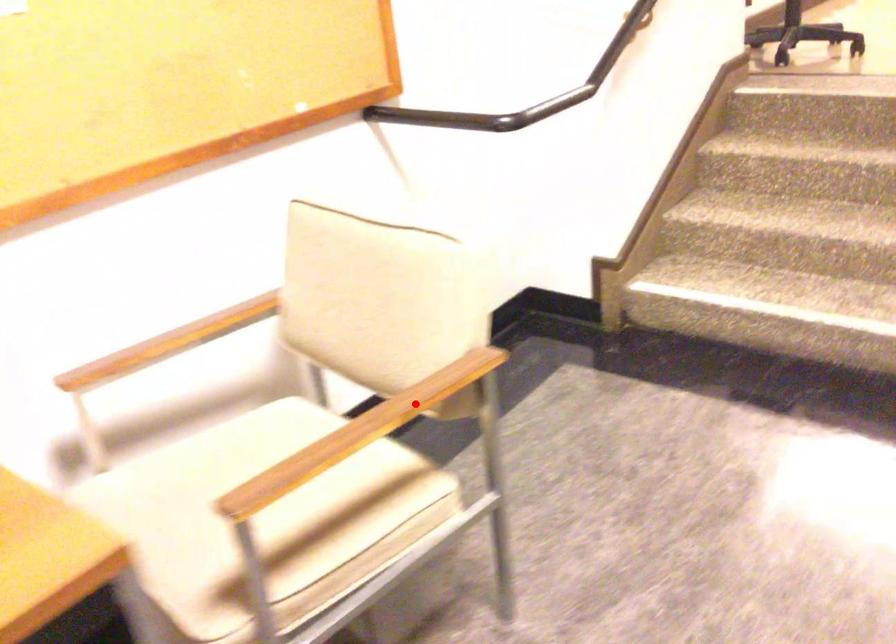
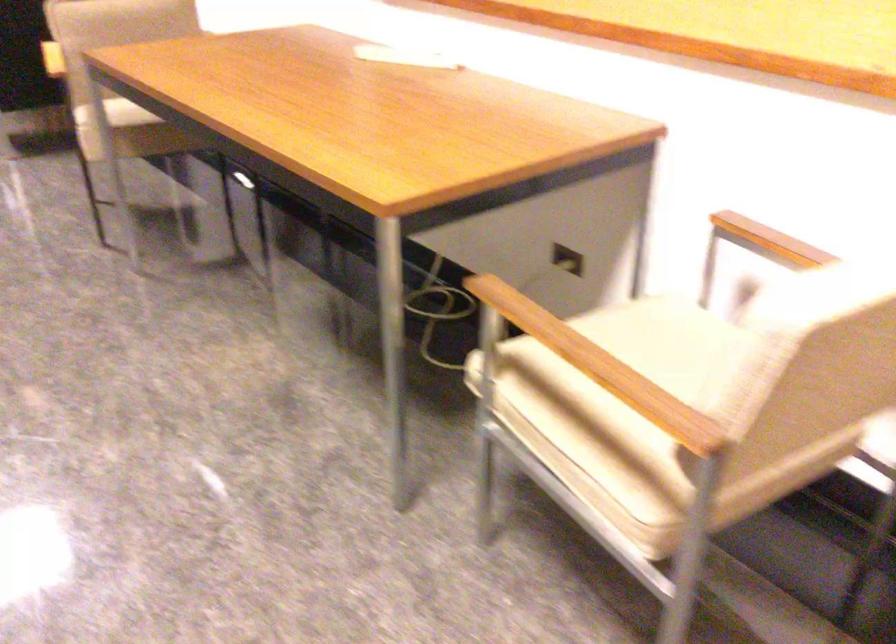
Question: I am providing you with two images of the same scene from different viewpoints. A red point is marked on the first image. Can you still see the location of the red point in image 2?

Choices:
 (A) Yes
 (B) No

Answer: (A)